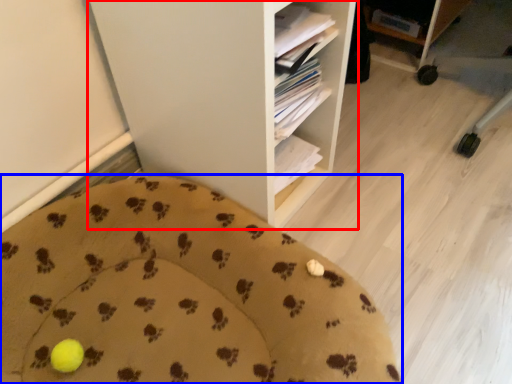
Question: Among these objects, which one is farthest to the camera, shelf (highlighted by a red box) or furniture (highlighted by a blue box)?

Choices:
 (A) shelf
 (B) furniture

Answer: (A)